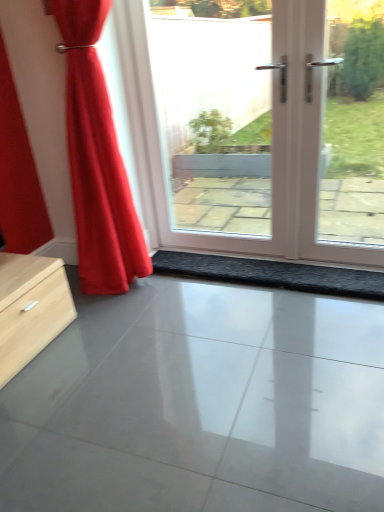
Question: Is white glossy door at center not inside black textured mat at center?

Choices:
 (A) no
 (B) yes

Answer: (B)

Question: Can you confirm if white glossy door at center is positioned to the right of black textured mat at center?

Choices:
 (A) no
 (B) yes

Answer: (B)

Question: Is white glossy door at center surrounding black textured mat at center?

Choices:
 (A) yes
 (B) no

Answer: (B)

Question: Considering the relative sizes of white glossy door at center and black textured mat at center in the image provided, is white glossy door at center shorter than black textured mat at center?

Choices:
 (A) no
 (B) yes

Answer: (A)

Question: Considering the relative sizes of white glossy door at center and black textured mat at center in the image provided, is white glossy door at center taller than black textured mat at center?

Choices:
 (A) yes
 (B) no

Answer: (A)

Question: From the image's perspective, relative to white glossy door at center, is glossy concrete floor at center above or below?

Choices:
 (A) below
 (B) above

Answer: (A)

Question: Choose the correct answer: Is glossy concrete floor at center inside white glossy door at center or outside it?

Choices:
 (A) inside
 (B) outside

Answer: (B)

Question: Considering the positions of glossy concrete floor at center and white glossy door at center in the image, is glossy concrete floor at center bigger or smaller than white glossy door at center?

Choices:
 (A) small
 (B) big

Answer: (A)

Question: Considering the relative positions of glossy concrete floor at center and white glossy door at center in the image provided, is glossy concrete floor at center to the left or to the right of white glossy door at center?

Choices:
 (A) left
 (B) right

Answer: (A)

Question: From the image's perspective, is black textured mat at center above or below glossy concrete floor at center?

Choices:
 (A) below
 (B) above

Answer: (B)

Question: Looking at the image, does black textured mat at center seem bigger or smaller compared to glossy concrete floor at center?

Choices:
 (A) big
 (B) small

Answer: (B)

Question: Considering the positions of black textured mat at center and glossy concrete floor at center in the image, is black textured mat at center wider or thinner than glossy concrete floor at center?

Choices:
 (A) thin
 (B) wide

Answer: (A)

Question: Which is correct: black textured mat at center is inside glossy concrete floor at center, or outside of it?

Choices:
 (A) outside
 (B) inside

Answer: (A)

Question: Considering the positions of point (274, 121) and point (77, 17), is point (274, 121) closer or farther from the camera than point (77, 17)?

Choices:
 (A) closer
 (B) farther

Answer: (B)

Question: Is white glossy door at center bigger or smaller than satin red curtain at left?

Choices:
 (A) big
 (B) small

Answer: (B)